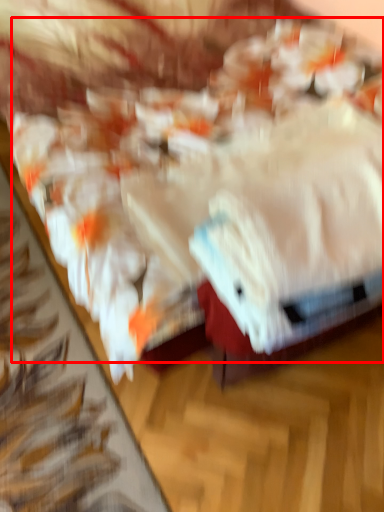
Question: In this image, where is food (annotated by the red box) located relative to towel?

Choices:
 (A) right
 (B) left

Answer: (B)